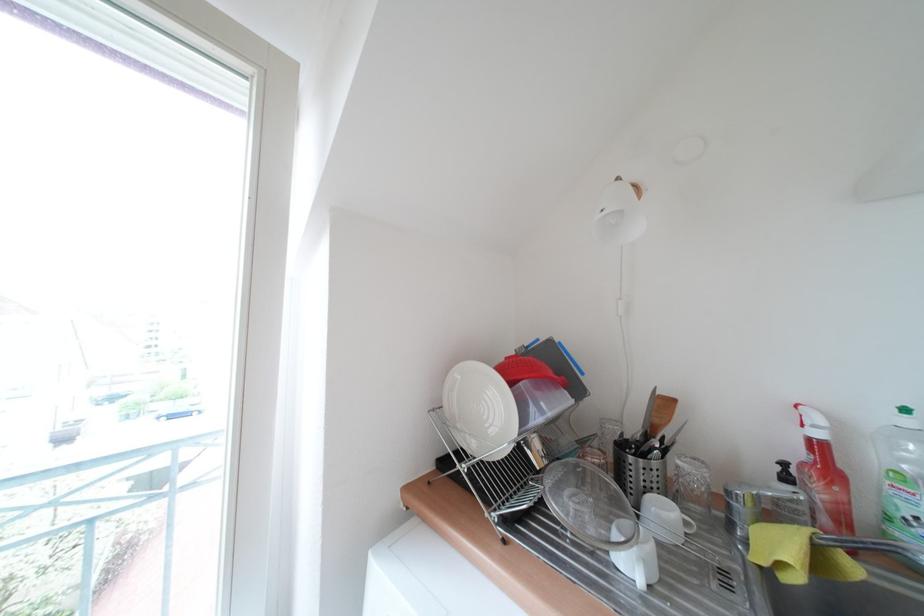
Describe the element at coordinates (784, 472) in the screenshot. I see `a black pump head` at that location.